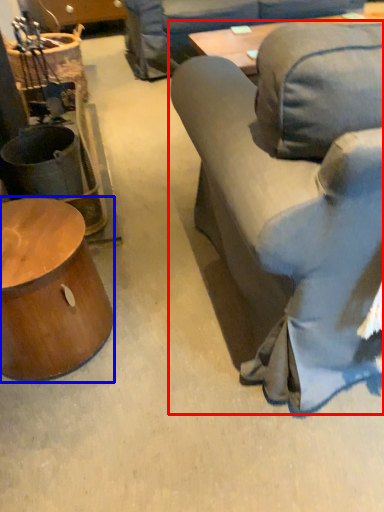
Question: Which of the following is the farthest to the observer, studio couch (highlighted by a red box) or table (highlighted by a blue box)?

Choices:
 (A) studio couch
 (B) table

Answer: (B)